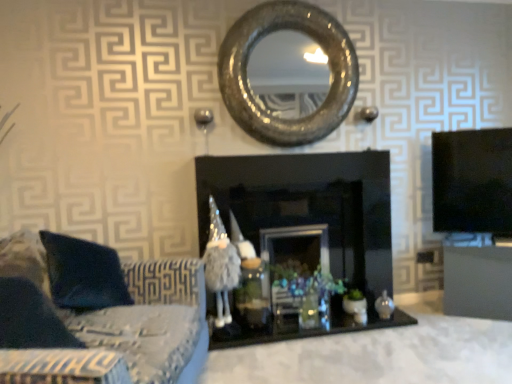
You are a GUI agent. You are given a task and a screenshot of the screen. Output one action in this format:
    pyautogui.click(x=<x>, y=<y>)
    Task: Click on the free space in front of black glossy fireplace at center
    This screenshot has width=512, height=384.
    Given the screenshot: What is the action you would take?
    pyautogui.click(x=328, y=359)